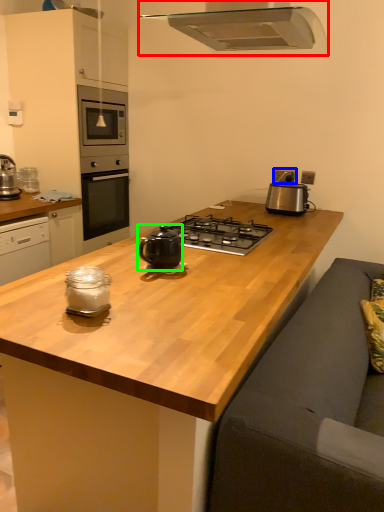
Question: Which object is positioned closest to home appliance (highlighted by a red box)? Select from electric outlet (highlighted by a blue box) and tea pot (highlighted by a green box).

Choices:
 (A) electric outlet
 (B) tea pot

Answer: (B)